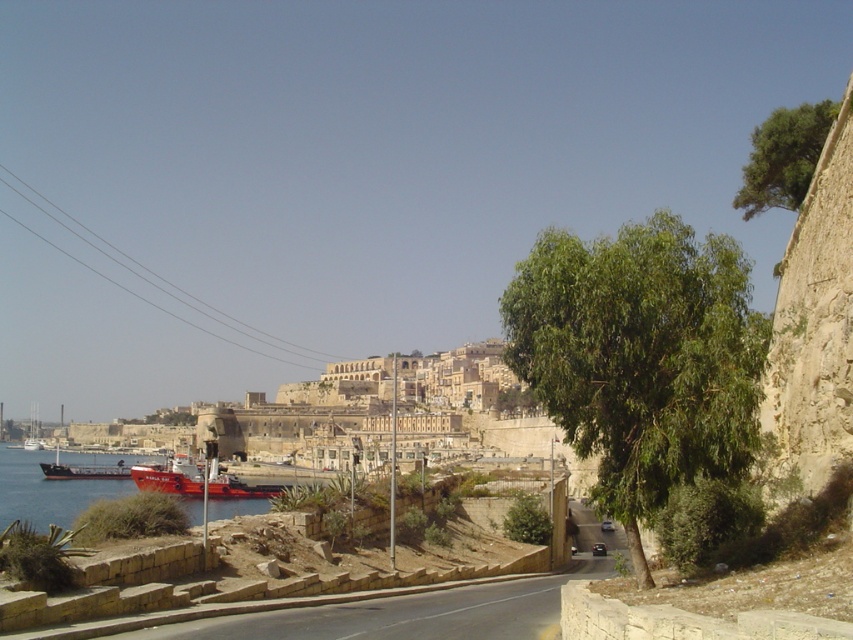
Question: Which object is positioned closest to the red matte ship at left?

Choices:
 (A) green leafy tree at upper right
 (B) red matte ship at lower left
 (C) green leafy tree at center

Answer: (B)

Question: Observing the image, what is the correct spatial positioning of red matte ship at lower left in reference to red matte ship at left?

Choices:
 (A) below
 (B) above

Answer: (B)

Question: Which object is positioned closest to the green leafy tree at upper right?

Choices:
 (A) red matte ship at lower left
 (B) green leafy tree at center
 (C) red matte ship at left

Answer: (B)

Question: Can you confirm if green leafy tree at center is thinner than red matte ship at left?

Choices:
 (A) yes
 (B) no

Answer: (A)

Question: In this image, where is green leafy tree at center located relative to green leafy tree at upper right?

Choices:
 (A) left
 (B) right

Answer: (A)

Question: Among these points, which one is farthest from the camera?

Choices:
 (A) (123, 460)
 (B) (645, 397)
 (C) (210, 490)

Answer: (A)